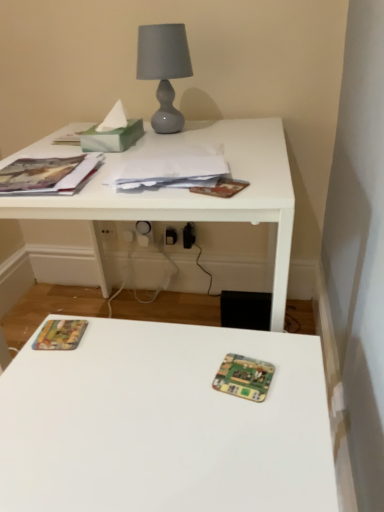
This screenshot has width=384, height=512. Identify the location of multicolored paper at lower left, acting as the first paperback book starting from the bottom. (60, 335).

Identify the location of white paper at center. Image resolution: width=384 pixels, height=512 pixels. (172, 168).

Locate an element on the screen. green marbled tissue at upper left is located at coordinates (112, 132).

Find the location of a particular element. multicolored paper at lower left, acting as the first paperback book starting from the bottom is located at coordinates (60, 335).

Is white glossy table at upper center located outside matte paper book at upper left, marked as the first paperback book in a top-to-bottom arrangement?

Yes, white glossy table at upper center is located beyond the bounds of matte paper book at upper left, marked as the first paperback book in a top-to-bottom arrangement.

From a real-world perspective, is white glossy table at upper center located higher than matte paper book at upper left, marked as the first paperback book in a top-to-bottom arrangement?

No, from a real-world perspective, white glossy table at upper center is not above matte paper book at upper left, marked as the first paperback book in a top-to-bottom arrangement.

Which is behind, point (248, 155) or point (44, 193)?

The point (248, 155) is more distant.

Is wooden printed card game at center aimed at white plastic electric outlet at center?

No.

Does wooden printed card game at center lie in front of white plastic electric outlet at center?

Yes.

Between wooden printed card game at center and white plastic electric outlet at center, which one has smaller width?

With smaller width is white plastic electric outlet at center.

Does point (254, 362) appear closer or farther from the camera than point (104, 226)?

Clearly, point (254, 362) is closer to the camera than point (104, 226).

Considering the positions of objects matte gray glass table lamp at upper center and white glossy table at upper center in the image provided, who is in front, matte gray glass table lamp at upper center or white glossy table at upper center?

Positioned in front is white glossy table at upper center.

From the image's perspective, which one is positioned lower, matte gray glass table lamp at upper center or white glossy table at upper center?

white glossy table at upper center appears lower in the image.

Considering the sizes of matte gray glass table lamp at upper center and white glossy table at upper center in the image, is matte gray glass table lamp at upper center bigger or smaller than white glossy table at upper center?

Considering their sizes, matte gray glass table lamp at upper center takes up less space than white glossy table at upper center.

Do you think matte gray glass table lamp at upper center is within white glossy table at upper center, or outside of it?

matte gray glass table lamp at upper center is not inside white glossy table at upper center, it's outside.

Is point (275, 224) closer or farther from the camera than point (105, 238)?

Clearly, point (275, 224) is closer to the camera than point (105, 238).

Are white glossy table at upper center and white plastic electric outlet at center beside each other?

No, white glossy table at upper center is not with white plastic electric outlet at center.

Which of these two, white glossy table at upper center or white plastic electric outlet at center, stands taller?

white glossy table at upper center is taller.

Is white glossy table at upper center outside of white plastic electric outlet at center?

Yes, white glossy table at upper center is located beyond the bounds of white plastic electric outlet at center.

Consider the image. From a real-world perspective, is white plastic electric outlet at center physically located above or below matte paper book at upper left, marked as the first paperback book in a top-to-bottom arrangement?

From a real-world perspective, white plastic electric outlet at center is physically below matte paper book at upper left, marked as the first paperback book in a top-to-bottom arrangement.

Does white plastic electric outlet at center have a lesser width compared to matte paper book at upper left, marked as the first paperback book in a top-to-bottom arrangement?

Yes.

Considering the positions of points (104, 238) and (8, 182), is point (104, 238) closer to camera compared to point (8, 182)?

No, it is not.

What's the angular difference between white plastic electric outlet at center and matte paper book at upper left, marked as the first paperback book in a top-to-bottom arrangement,'s facing directions?

They differ by 3.72 degrees in their facing directions.

Which is in front, point (91, 167) or point (246, 372)?

The point (246, 372) is in front.

Would you say matte paper book at upper left, marked as the first paperback book in a top-to-bottom arrangement, is to the left or to the right of wooden printed card game at center in the picture?

matte paper book at upper left, marked as the first paperback book in a top-to-bottom arrangement, is to the left of wooden printed card game at center.

Based on the photo, could wooden printed card game at center be considered to be inside matte paper book at upper left, the second paperback book from the bottom?

No, wooden printed card game at center is located outside of matte paper book at upper left, the second paperback book from the bottom.

Between matte paper book at upper left, marked as the first paperback book in a top-to-bottom arrangement, and wooden printed card game at center, which one is positioned in front?

wooden printed card game at center is more forward.

From their relative heights in the image, would you say white paper at center is taller or shorter than white plastic electric outlet at center?

Clearly, white paper at center is shorter compared to white plastic electric outlet at center.

Considering the positions of points (185, 157) and (111, 226), is point (185, 157) closer to camera compared to point (111, 226)?

Yes, point (185, 157) is in front of point (111, 226).

From the image's perspective, is white paper at center under white plastic electric outlet at center?

Incorrect, from the image's perspective, white paper at center is higher than white plastic electric outlet at center.

The image size is (384, 512). I want to click on magazine that appears above the white plastic electric outlet at center (from the image's perspective), so (172, 168).

You are a GUI agent. You are given a task and a screenshot of the screen. Output one action in this format:
    pyautogui.click(x=<x>, y=<y>)
    Task: Click on the table below the matte paper book at upper left, marked as the first paperback book in a top-to-bottom arrangement (from a real-world perspective)
    
    Given the screenshot: What is the action you would take?
    183,202

This screenshot has height=512, width=384. In order to click on electric outlet above the wooden printed card game at center (from the image's perspective) in this screenshot , I will do `click(107, 230)`.

Looking at this image, when comparing their distances from multicolored paper at lower left, acting as the first paperback book starting from the bottom, does white plastic electric outlet at center or matte gray glass table lamp at upper center seem further?

white plastic electric outlet at center lies further to multicolored paper at lower left, acting as the first paperback book starting from the bottom, than the other object.

Based on their spatial positions, is wooden printed card game at center or matte paper book at upper left, the second paperback book from the bottom, further from white plastic electric outlet at center?

wooden printed card game at center is further to white plastic electric outlet at center.

Estimate the real-world distances between objects in this image. Which object is further from multicolored paper at lower left, acting as the first paperback book starting from the bottom, wooden printed card game at center or matte gray glass table lamp at upper center?

Based on the image, matte gray glass table lamp at upper center appears to be further to multicolored paper at lower left, acting as the first paperback book starting from the bottom.

When comparing their distances from matte paper book at upper left, the second paperback book from the bottom, does white plastic electric outlet at center or matte gray glass table lamp at upper center seem closer?

Based on the image, matte gray glass table lamp at upper center appears to be nearer to matte paper book at upper left, the second paperback book from the bottom.

Estimate the real-world distances between objects in this image. Which object is closer to green marbled tissue at upper left, white glossy table at upper center or matte gray glass table lamp at upper center?

matte gray glass table lamp at upper center is positioned closer to the anchor green marbled tissue at upper left.

Considering their positions, is wooden printed card game at center positioned further to matte paper book at upper left, marked as the first paperback book in a top-to-bottom arrangement, than white plastic electric outlet at center?

white plastic electric outlet at center.

From the image, which object appears to be nearer to multicolored paper at lower left, acting as the first paperback book starting from the bottom, wooden printed card game at center or white paper at center?

The object closer to multicolored paper at lower left, acting as the first paperback book starting from the bottom, is wooden printed card game at center.

Based on the photo, from the image, which object appears to be farther from white plastic electric outlet at center, white glossy table at upper center or matte paper book at upper left, the second paperback book from the bottom?

matte paper book at upper left, the second paperback book from the bottom, lies further to white plastic electric outlet at center than the other object.

At what (x,y) coordinates should I click in order to perform the action: click on magazine that lies between green marbled tissue at upper left and wooden printed card game at center from top to bottom. Please return your answer as a coordinate pair (x, y). The image size is (384, 512). Looking at the image, I should click on (172, 168).

The image size is (384, 512). I want to click on paperback book between white paper at center and wooden printed card game at center in the up-down direction, so click(60, 335).

Image resolution: width=384 pixels, height=512 pixels. I want to click on table between wooden printed card game at center and white plastic electric outlet at center in the front-back direction, so click(x=183, y=202).

At what (x,y) coordinates should I click in order to perform the action: click on tissue between matte gray glass table lamp at upper center and white glossy table at upper center from top to bottom. Please return your answer as a coordinate pair (x, y). This screenshot has height=512, width=384. Looking at the image, I should click on (112, 132).